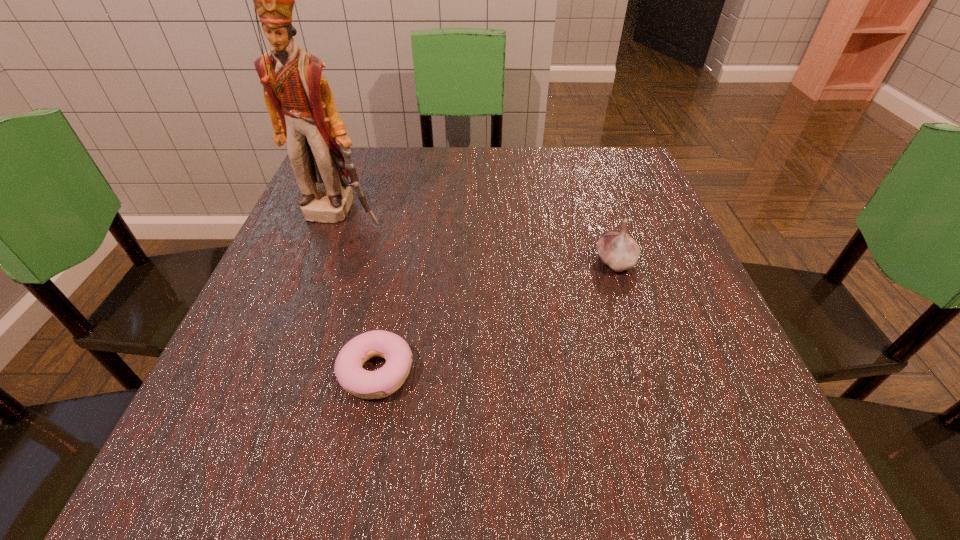
Identify the location of object that is at the left edge. Image resolution: width=960 pixels, height=540 pixels. (302, 109).

Where is `object present at the right edge`? The height and width of the screenshot is (540, 960). object present at the right edge is located at coordinates (619, 251).

This screenshot has width=960, height=540. Find the location of `object that is at the far left corner`. object that is at the far left corner is located at coordinates (302, 109).

This screenshot has height=540, width=960. I want to click on vacant space at the far edge, so click(498, 195).

Locate an element on the screen. This screenshot has height=540, width=960. vacant area at the near edge is located at coordinates point(611,458).

In the image, there is a desktop. At what (x,y) coordinates should I click in order to perform the action: click on free space at the left edge. Please return your answer as a coordinate pair (x, y). The image size is (960, 540). Looking at the image, I should click on (345, 262).

Image resolution: width=960 pixels, height=540 pixels. In the image, there is a desktop. What are the coordinates of `vacant area at the right edge` in the screenshot? It's located at (708, 346).

In the image, there is a desktop. Identify the location of vacant space at the near left corner. (304, 444).

The image size is (960, 540). I want to click on vacant space at the far right corner of the desktop, so click(574, 174).

What are the coordinates of `free space between the second tallest object and the farthest object` in the screenshot? It's located at (478, 238).